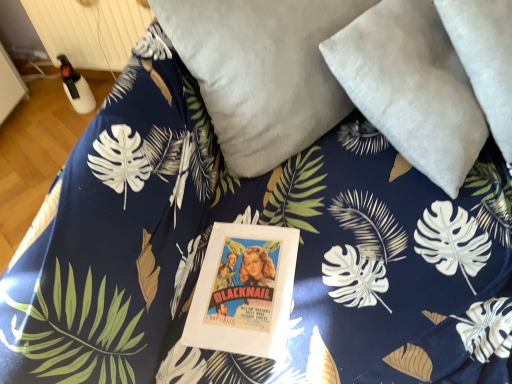
Question: Does suede-like gray pillow at upper right, the first pillow positioned from the right, have a greater width compared to white plastic radiator at upper left?

Choices:
 (A) yes
 (B) no

Answer: (A)

Question: Does suede-like gray pillow at upper right, the first pillow positioned from the right, have a larger size compared to white plastic radiator at upper left?

Choices:
 (A) yes
 (B) no

Answer: (A)

Question: Considering the relative sizes of suede-like gray pillow at upper right, the second pillow from the left, and white plastic radiator at upper left in the image provided, is suede-like gray pillow at upper right, the second pillow from the left, thinner than white plastic radiator at upper left?

Choices:
 (A) yes
 (B) no

Answer: (B)

Question: Is suede-like gray pillow at upper right, the second pillow from the left, directly adjacent to white plastic radiator at upper left?

Choices:
 (A) yes
 (B) no

Answer: (B)

Question: From the image's perspective, is suede-like gray pillow at upper right, the first pillow positioned from the right, under white plastic radiator at upper left?

Choices:
 (A) no
 (B) yes

Answer: (B)

Question: Does suede-like gray pillow at upper right, the first pillow positioned from the right, have a smaller size compared to white plastic radiator at upper left?

Choices:
 (A) no
 (B) yes

Answer: (A)

Question: Would you say suede-like gray pillow at upper right, the second pillow from the left, is part of white plastic radiator at upper left's contents?

Choices:
 (A) no
 (B) yes

Answer: (A)

Question: Are white plastic radiator at upper left and suede-like gray pillow at upper right, the second pillow from the left, far apart?

Choices:
 (A) yes
 (B) no

Answer: (A)

Question: From a real-world perspective, is white plastic radiator at upper left located higher than suede-like gray pillow at upper right, the first pillow positioned from the right?

Choices:
 (A) no
 (B) yes

Answer: (A)

Question: Is white plastic radiator at upper left taller than suede-like gray pillow at upper right, the first pillow positioned from the right?

Choices:
 (A) yes
 (B) no

Answer: (B)

Question: Considering the relative positions of white plastic radiator at upper left and suede-like gray pillow at upper right, the first pillow positioned from the right, in the image provided, is white plastic radiator at upper left behind suede-like gray pillow at upper right, the first pillow positioned from the right,?

Choices:
 (A) no
 (B) yes

Answer: (B)

Question: Is white plastic radiator at upper left aimed at suede-like gray pillow at upper right, the second pillow from the left?

Choices:
 (A) yes
 (B) no

Answer: (B)

Question: Is velvety gray pillow at upper center, marked as the 1th pillow in a left-to-right arrangement, at the back of white plastic radiator at upper left?

Choices:
 (A) yes
 (B) no

Answer: (B)